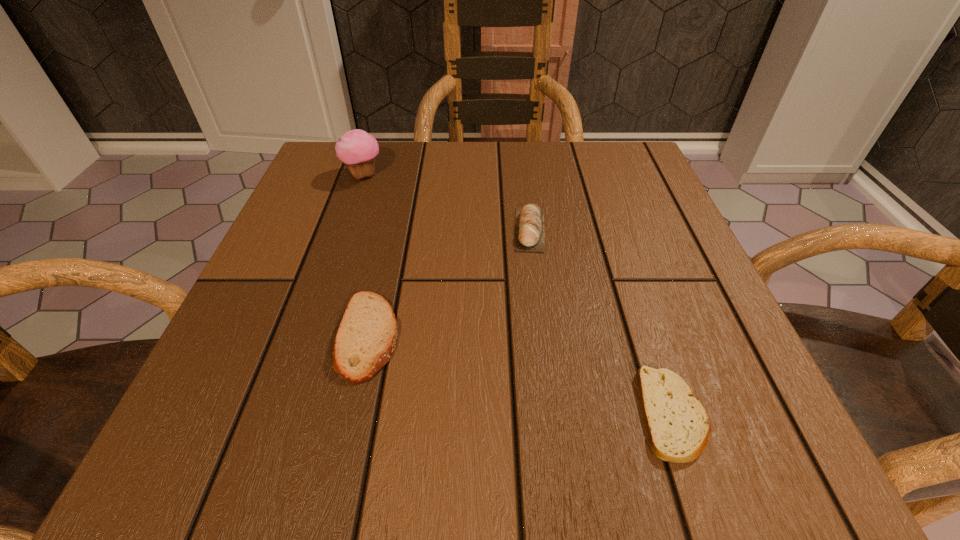
Locate an element on the screen. This screenshot has height=540, width=960. free space at the left edge of the desktop is located at coordinates (251, 331).

At what (x,y) coordinates should I click in order to perform the action: click on free space at the right edge of the desktop. Please return your answer as a coordinate pair (x, y). Looking at the image, I should click on (710, 304).

The width and height of the screenshot is (960, 540). In the image, there is a desktop. What are the coordinates of `vacant space at the far left corner` in the screenshot? It's located at (313, 180).

Find the location of a particular element. free point between the rightmost pita bread and the second object from right to left is located at coordinates (601, 322).

What are the coordinates of `vacant area that lies between the second pita bread from left to right and the shortest object` in the screenshot? It's located at (601, 322).

This screenshot has height=540, width=960. In order to click on free space between the second farthest object and the tallest object in this screenshot , I will do `click(446, 202)`.

At what (x,y) coordinates should I click in order to perform the action: click on vacant area that lies between the rightmost object and the second pita bread from left to right. Please return your answer as a coordinate pair (x, y). The image size is (960, 540). Looking at the image, I should click on (601, 322).

This screenshot has width=960, height=540. Find the location of `free area in between the rightmost pita bread and the third tallest object`. free area in between the rightmost pita bread and the third tallest object is located at coordinates (520, 375).

This screenshot has height=540, width=960. What are the coordinates of `vacant region between the farthest pita bread and the third tallest object` in the screenshot? It's located at (449, 282).

In order to click on free space between the farthest object and the shortest pita bread in this screenshot , I will do coord(517,295).